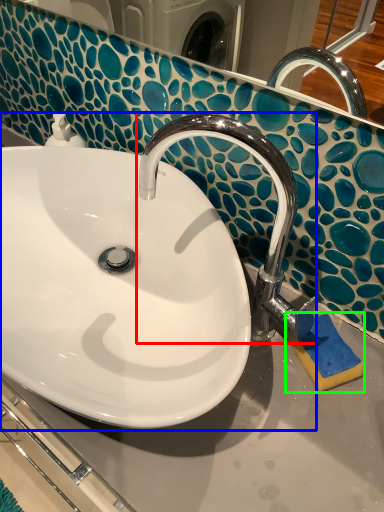
Question: Which object is the farthest from tap (highlighted by a red box)? Choose among these: sink (highlighted by a blue box) or soap (highlighted by a green box).

Choices:
 (A) sink
 (B) soap

Answer: (B)